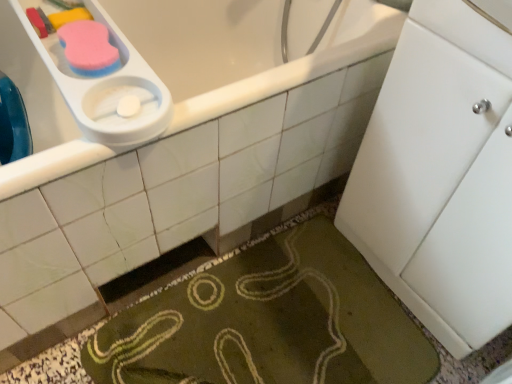
Where is `green textured bath mat at lower center`? Image resolution: width=512 pixels, height=384 pixels. green textured bath mat at lower center is located at coordinates tap(267, 321).

Describe the element at coordinates (267, 321) in the screenshot. Image resolution: width=512 pixels, height=384 pixels. I see `green textured bath mat at lower center` at that location.

The image size is (512, 384). Find the location of `green textured bath mat at lower center`. green textured bath mat at lower center is located at coordinates (267, 321).